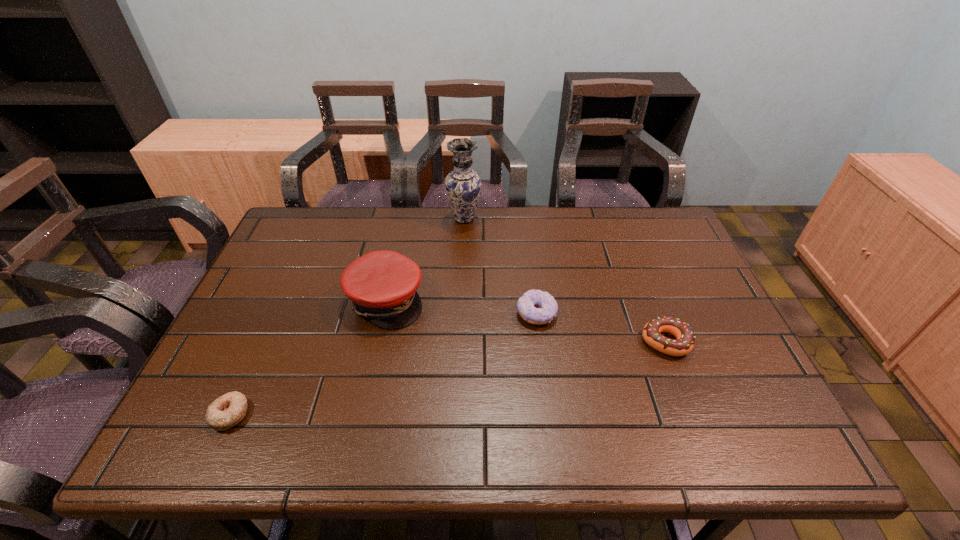
The width and height of the screenshot is (960, 540). What are the coordinates of `the third object from right to left` in the screenshot? It's located at (463, 185).

Locate an element on the screen. This screenshot has height=540, width=960. the tallest object is located at coordinates coord(463,185).

Locate an element on the screen. cap is located at coordinates (382, 285).

This screenshot has width=960, height=540. I want to click on the second object from left to right, so click(x=382, y=285).

Image resolution: width=960 pixels, height=540 pixels. I want to click on the rightmost doughnut, so click(683, 344).

The height and width of the screenshot is (540, 960). Identify the location of the second object from right to left. (538, 307).

At what (x,y) coordinates should I click in order to perform the action: click on the nearest doughnut. Please return your answer as a coordinate pair (x, y). The width and height of the screenshot is (960, 540). Looking at the image, I should click on (228, 410).

Find the location of a particular element. the leftmost object is located at coordinates (228, 410).

The width and height of the screenshot is (960, 540). I want to click on vacant region located 0.350m on the left of the third object from right to left, so click(341, 219).

Where is `vacant point located on the front-facing side of the cap`? This screenshot has width=960, height=540. vacant point located on the front-facing side of the cap is located at coordinates (442, 300).